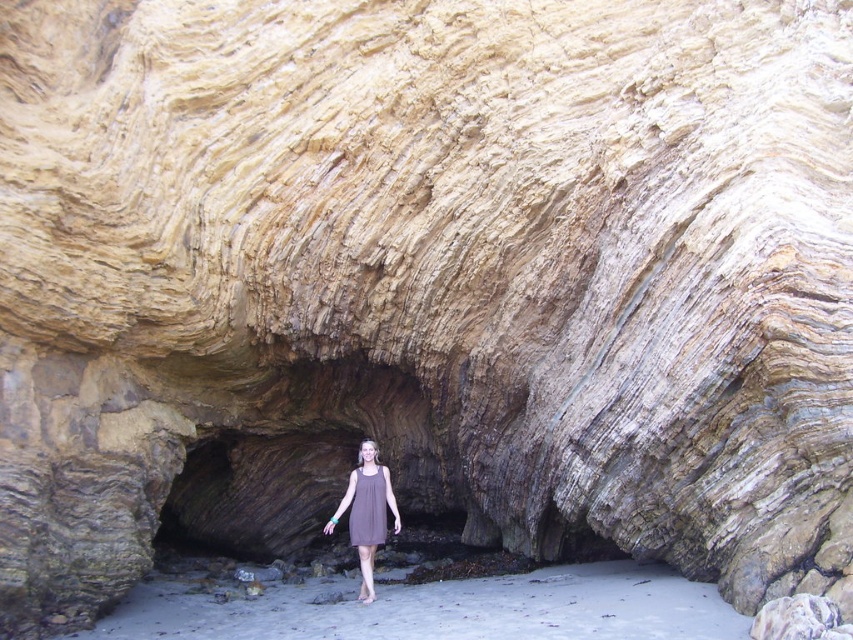
Is sandy beach at lower center to the right of brown fabric dress at center from the viewer's perspective?

Correct, you'll find sandy beach at lower center to the right of brown fabric dress at center.

Based on the photo, can you confirm if sandy beach at lower center is bigger than brown fabric dress at center?

Correct, sandy beach at lower center is larger in size than brown fabric dress at center.

At what (x,y) coordinates should I click in order to perform the action: click on sandy beach at lower center. Please return your answer as a coordinate pair (x, y). This screenshot has width=853, height=640. Looking at the image, I should click on [436, 609].

Identify the location of brown fabric dress at center. (366, 512).

Which of these two, brown fabric dress at center or purple cotton dress at center, stands taller?

With more height is brown fabric dress at center.

Who is more distant from viewer, (363, 497) or (384, 516)?

The point (384, 516) is behind.

Identify the location of brown fabric dress at center. (366, 512).

Looking at this image, can you confirm if sandy beach at lower center is taller than purple cotton dress at center?

Yes, sandy beach at lower center is taller than purple cotton dress at center.

Based on the photo, between sandy beach at lower center and purple cotton dress at center, which one appears on the left side from the viewer's perspective?

sandy beach at lower center

Identify the location of sandy beach at lower center. (436, 609).